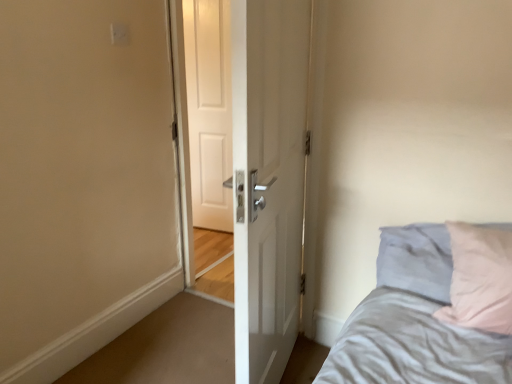
This screenshot has width=512, height=384. In order to click on white plastic electric outlet at upper center in this screenshot , I will do `click(119, 34)`.

The height and width of the screenshot is (384, 512). I want to click on white glossy door at center, so click(268, 179).

Between white glossy door at center and white plastic electric outlet at upper center, which one is positioned behind?

white plastic electric outlet at upper center.

Between white glossy door at center and white plastic electric outlet at upper center, which one has more height?

With more height is white glossy door at center.

Which of these two, white glossy door at center or white plastic electric outlet at upper center, is smaller?

With smaller size is white plastic electric outlet at upper center.

Considering the positions of objects white glossy door at center and white plastic electric outlet at upper center in the image provided, who is more to the left, white glossy door at center or white plastic electric outlet at upper center?

Positioned to the left is white plastic electric outlet at upper center.

Does white plastic electric outlet at upper center have a larger size compared to white glossy door at center?

No, white plastic electric outlet at upper center is not bigger than white glossy door at center.

Which object is closer to the camera, white plastic electric outlet at upper center or white glossy door at center?

white glossy door at center.

From a real-world perspective, is white plastic electric outlet at upper center positioned above or below white glossy door at center?

In terms of real-world spatial position, white plastic electric outlet at upper center is above white glossy door at center.

How far apart are white plastic electric outlet at upper center and white glossy door at center?

1.15 meters.

Is point (226, 132) farther from camera compared to point (266, 377)?

Yes, point (226, 132) is behind point (266, 377).

Is white matte door at center turned away from white glossy door at center?

white matte door at center does not have its back to white glossy door at center.

Would you say white matte door at center is to the left or to the right of white glossy door at center in the picture?

Based on their positions, white matte door at center is located to the left of white glossy door at center.

Would you say white matte door at center is inside or outside white glossy door at center?

white matte door at center is not enclosed by white glossy door at center.

From a real-world perspective, is white matte door at center located higher than white plastic electric outlet at upper center?

No, from a real-world perspective, white matte door at center is not on top of white plastic electric outlet at upper center.

Is white matte door at center next to white plastic electric outlet at upper center?

No, white matte door at center is not touching white plastic electric outlet at upper center.

Can you tell me how much white matte door at center and white plastic electric outlet at upper center differ in facing direction?

1.87 degrees separate the facing orientations of white matte door at center and white plastic electric outlet at upper center.

From the picture: How far apart are white matte door at center and white plastic electric outlet at upper center?

white matte door at center and white plastic electric outlet at upper center are 1.32 meters apart from each other.

Where is `electric outlet in front of the white matte door at center`? electric outlet in front of the white matte door at center is located at coordinates (119, 34).

Is white plastic electric outlet at upper center positioned in front of white matte door at center?

Yes, white plastic electric outlet at upper center is closer to the viewer.

From a real-world perspective, which is physically below, white plastic electric outlet at upper center or white matte door at center?

From a 3D spatial view, white matte door at center is below.

Is white matte door at center at the back of white plastic electric outlet at upper center?

No, white plastic electric outlet at upper center's orientation is not away from white matte door at center.

From the image's perspective, which is below, white glossy door at center or white matte door at center?

white glossy door at center.

Does white glossy door at center turn towards white matte door at center?

No.

Is the depth of white glossy door at center less than that of white matte door at center?

Yes, white glossy door at center is closer to the viewer.

Can you confirm if white glossy door at center is thinner than white matte door at center?

No, white glossy door at center is not thinner than white matte door at center.

Find the location of `electric outlet above the white glossy door at center (from a real-world perspective)`. electric outlet above the white glossy door at center (from a real-world perspective) is located at coordinates (119, 34).

The height and width of the screenshot is (384, 512). In order to click on electric outlet located above the white glossy door at center (from the image's perspective) in this screenshot , I will do [119, 34].

Estimate the real-world distances between objects in this image. Which object is closer to white matte door at center, white glossy door at center or white plastic electric outlet at upper center?

white plastic electric outlet at upper center is positioned closer to the anchor white matte door at center.

From the image, which object appears to be nearer to white matte door at center, white plastic electric outlet at upper center or white glossy door at center?

The object closer to white matte door at center is white plastic electric outlet at upper center.

Estimate the real-world distances between objects in this image. Which object is closer to white glossy door at center, white matte door at center or white plastic electric outlet at upper center?

The object closer to white glossy door at center is white plastic electric outlet at upper center.

Which object lies further to the anchor point white plastic electric outlet at upper center, white matte door at center or white glossy door at center?

white matte door at center lies further to white plastic electric outlet at upper center than the other object.

Considering their positions, is white plastic electric outlet at upper center positioned closer to white glossy door at center than white matte door at center?

white plastic electric outlet at upper center is positioned closer to the anchor white glossy door at center.

Which object lies further to the anchor point white plastic electric outlet at upper center, white glossy door at center or white matte door at center?

white matte door at center lies further to white plastic electric outlet at upper center than the other object.

Where is `electric outlet between white glossy door at center and white matte door at center in the front-back direction`? Image resolution: width=512 pixels, height=384 pixels. electric outlet between white glossy door at center and white matte door at center in the front-back direction is located at coordinates pyautogui.click(x=119, y=34).